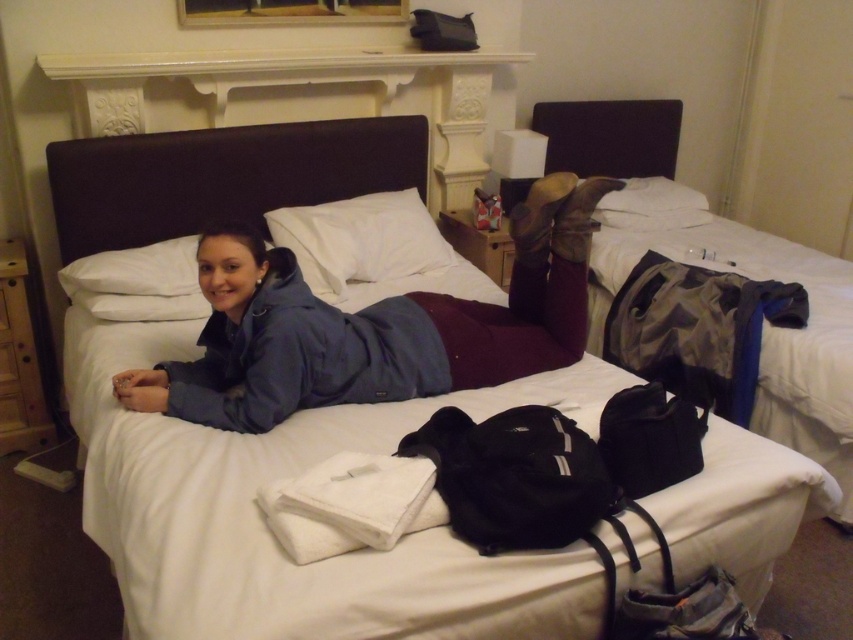
Is the position of blue fabric jacket at center less distant than that of white soft pillow at upper center?

Yes, it is.

Is blue fabric jacket at center wider than white soft pillow at upper center?

Indeed, blue fabric jacket at center has a greater width compared to white soft pillow at upper center.

Which is behind, point (206, 392) or point (302, 253)?

Positioned behind is point (302, 253).

Identify the location of blue fabric jacket at center. (376, 326).

Is blue fabric jacket at center smaller than dark brown leather bed at right?

Yes, blue fabric jacket at center is smaller than dark brown leather bed at right.

Who is more distant from viewer, (277, 268) or (758, 429)?

The point (758, 429) is more distant.

You are a GUI agent. You are given a task and a screenshot of the screen. Output one action in this format:
    pyautogui.click(x=<x>, y=<y>)
    Task: Click on the blue fabric jacket at center
    The height and width of the screenshot is (640, 853).
    Given the screenshot: What is the action you would take?
    pyautogui.click(x=376, y=326)

Between dark brown leather headboard at upper center and dark brown leather bed at right, which one has more height?

dark brown leather bed at right

Looking at this image, can you confirm if dark brown leather headboard at upper center is thinner than dark brown leather bed at right?

No, dark brown leather headboard at upper center is not thinner than dark brown leather bed at right.

The width and height of the screenshot is (853, 640). Describe the element at coordinates (221, 177) in the screenshot. I see `dark brown leather headboard at upper center` at that location.

Locate an element on the screen. The image size is (853, 640). dark brown leather headboard at upper center is located at coordinates (221, 177).